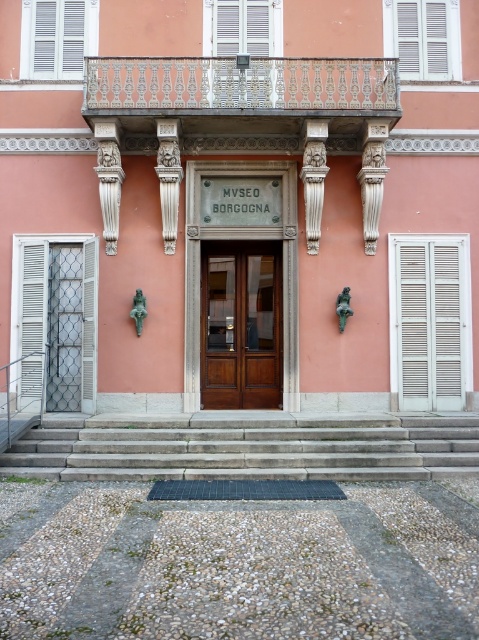
Question: Which of the following is the closest to the observer?

Choices:
 (A) gray concrete stairs at center
 (B) white matte shutter at upper center
 (C) white textured shutter at left

Answer: (A)

Question: Does white textured shutter at left have a greater width compared to white matte shutter at upper center?

Choices:
 (A) yes
 (B) no

Answer: (A)

Question: Among these points, which one is nearest to the camera?

Choices:
 (A) (398, 6)
 (B) (53, 35)

Answer: (B)

Question: Which point is closer to the camera taking this photo?

Choices:
 (A) (406, 22)
 (B) (276, 388)
 (C) (403, 476)
 (D) (467, 330)

Answer: (C)

Question: Does white matte shutter at upper center appear on the left side of white matte shutter at upper left?

Choices:
 (A) no
 (B) yes

Answer: (A)

Question: Is white wooden shutters at right positioned in front of white matte shutter at upper center?

Choices:
 (A) yes
 (B) no

Answer: (A)